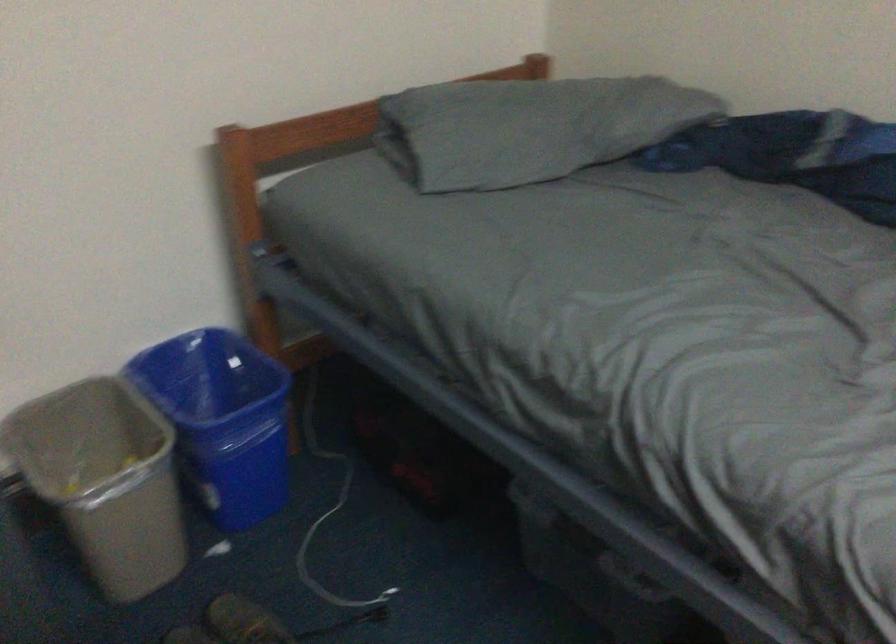
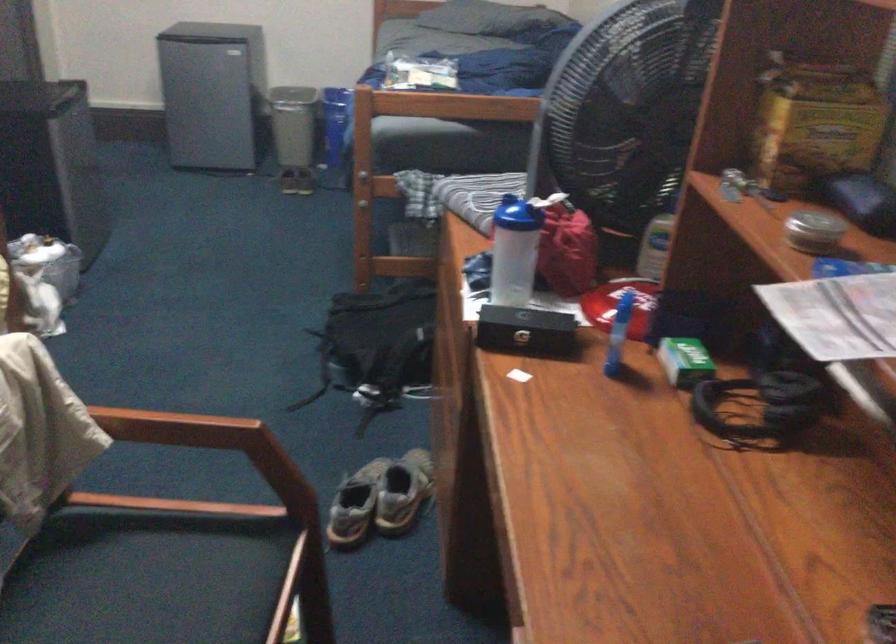
Question: I am providing you with two images of the same scene from different viewpoints. Please identify which objects are invisible in image2.

Choices:
 (A) red container handle
 (B) black rectangular case
 (C) white electrical cable
 (D) yellow cardboard box

Answer: (C)